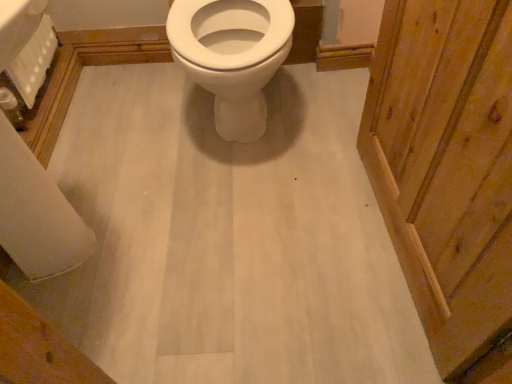
Question: Considering the relative positions of white textured toilet paper at upper left, the 1th toilet paper positioned from the left, and white glossy toilet at center in the image provided, is white textured toilet paper at upper left, the 1th toilet paper positioned from the left, behind white glossy toilet at center?

Choices:
 (A) yes
 (B) no

Answer: (A)

Question: Is white textured toilet paper at upper left, the 1th toilet paper positioned from the left, not near white glossy toilet at center?

Choices:
 (A) yes
 (B) no

Answer: (B)

Question: From a real-world perspective, is white textured toilet paper at upper left, the 1th toilet paper positioned from the left, positioned over white glossy toilet at center based on gravity?

Choices:
 (A) yes
 (B) no

Answer: (B)

Question: Is white textured toilet paper at upper left, the 1th toilet paper positioned from the left, shorter than white glossy toilet at center?

Choices:
 (A) no
 (B) yes

Answer: (B)

Question: Is white textured toilet paper at upper left, the 1th toilet paper positioned from the left, turned away from white glossy toilet at center?

Choices:
 (A) yes
 (B) no

Answer: (B)

Question: Is white textured toilet paper at upper left, which appears as the 2th toilet paper when viewed from the right, to the left of white glossy toilet at center from the viewer's perspective?

Choices:
 (A) no
 (B) yes

Answer: (B)

Question: Is white matte toilet paper at lower left, the second toilet paper viewed from the left, thinner than white glossy toilet at center?

Choices:
 (A) no
 (B) yes

Answer: (B)

Question: Does white matte toilet paper at lower left, which is counted as the 1th toilet paper, starting from the right, have a lesser height compared to white glossy toilet at center?

Choices:
 (A) no
 (B) yes

Answer: (B)

Question: From the image's perspective, is white matte toilet paper at lower left, the second toilet paper viewed from the left, located beneath white glossy toilet at center?

Choices:
 (A) yes
 (B) no

Answer: (A)

Question: Does white matte toilet paper at lower left, the second toilet paper viewed from the left, appear on the right side of white glossy toilet at center?

Choices:
 (A) no
 (B) yes

Answer: (A)

Question: From the image's perspective, is white matte toilet paper at lower left, which is counted as the 1th toilet paper, starting from the right, on white glossy toilet at center?

Choices:
 (A) yes
 (B) no

Answer: (B)

Question: Is white matte toilet paper at lower left, which is counted as the 1th toilet paper, starting from the right, taller than white glossy toilet at center?

Choices:
 (A) yes
 (B) no

Answer: (B)

Question: Is white matte toilet paper at lower left, which is counted as the 1th toilet paper, starting from the right, not close to white textured toilet paper at upper left, which appears as the 2th toilet paper when viewed from the right?

Choices:
 (A) no
 (B) yes

Answer: (A)